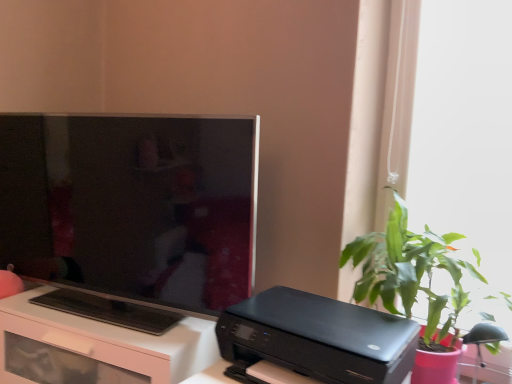
Question: From a real-world perspective, is black glossy printer at lower center positioned above or below white glossy desk at lower left?

Choices:
 (A) below
 (B) above

Answer: (B)

Question: From the image's perspective, is black glossy printer at lower center above or below white glossy desk at lower left?

Choices:
 (A) above
 (B) below

Answer: (A)

Question: Which of these objects is positioned farthest from the green leafy plant at right?

Choices:
 (A) matte black tv at left
 (B) black glossy printer at lower center
 (C) white glossy desk at lower left

Answer: (C)

Question: Estimate the real-world distances between objects in this image. Which object is farther from the white glossy desk at lower left?

Choices:
 (A) matte black tv at left
 (B) black glossy printer at lower center
 (C) green leafy plant at right

Answer: (C)